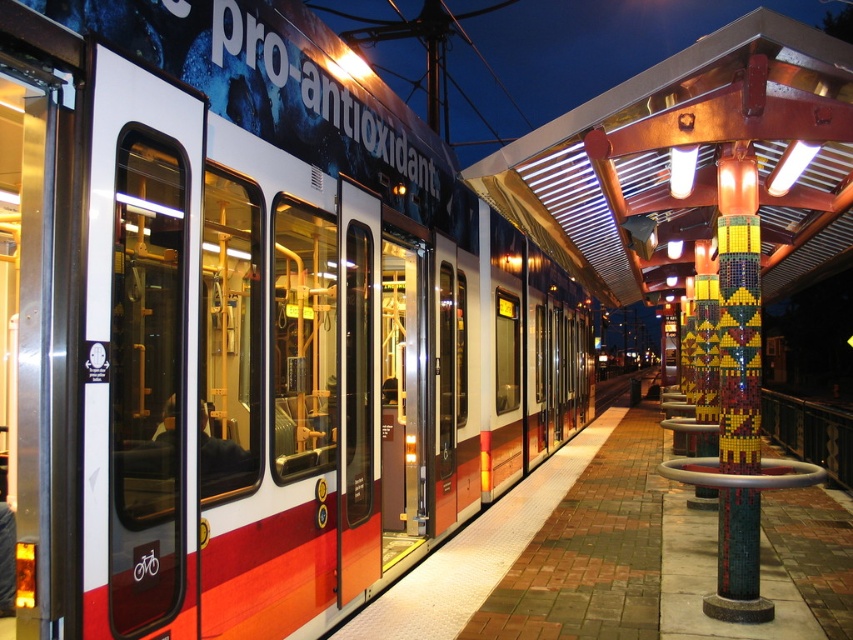
Question: Estimate the real-world distances between objects in this image. Which object is closer to the mosaic tile column at right?

Choices:
 (A) multicolored mosaic pillar at right
 (B) metallic red train at center

Answer: (A)

Question: Does metallic red train at center have a larger size compared to multicolored mosaic pillar at right?

Choices:
 (A) yes
 (B) no

Answer: (A)

Question: Which of the following is the closest to the observer?

Choices:
 (A) tap(695, 342)
 (B) tap(387, 202)

Answer: (B)

Question: Which of the following is the closest to the observer?

Choices:
 (A) (724, 273)
 (B) (27, 45)
 (C) (700, 499)

Answer: (B)

Question: From the image, what is the correct spatial relationship of metallic red train at center in relation to multicolored mosaic pillar at right?

Choices:
 (A) below
 (B) above

Answer: (B)

Question: Can you confirm if mosaic tile column at right is positioned below multicolored mosaic pillar at right?

Choices:
 (A) no
 (B) yes

Answer: (A)